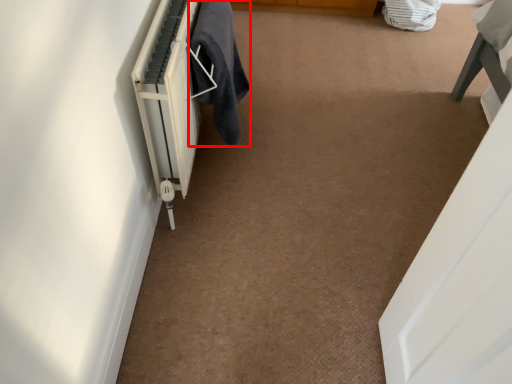
Question: From the image, what is the correct spatial relationship of laundry (annotated by the red box) in relation to radiator?

Choices:
 (A) left
 (B) right

Answer: (B)